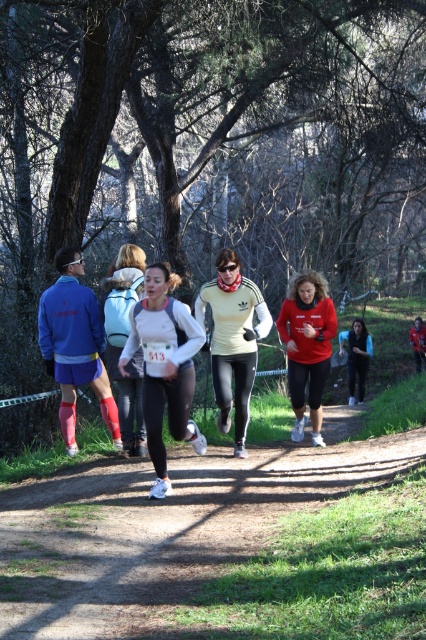
Can you confirm if matte yellow top at center is positioned below red matte running top at center?

Incorrect, matte yellow top at center is not positioned below red matte running top at center.

Which is in front, point (218, 349) or point (282, 328)?

Point (218, 349) is in front.

Locate an element on the screen. matte yellow top at center is located at coordinates (233, 340).

Looking at this image, is white jersey at center bigger than black matte leggings at center?

Yes, white jersey at center is bigger than black matte leggings at center.

Is white jersey at center to the right of black matte leggings at center from the viewer's perspective?

No, white jersey at center is not to the right of black matte leggings at center.

The image size is (426, 640). Find the location of `white jersey at center`. white jersey at center is located at coordinates (124, 340).

Between matte yellow top at center and black matte leggings at center, which one is positioned higher?

matte yellow top at center is above.

Does matte yellow top at center have a larger size compared to black matte leggings at center?

No, matte yellow top at center is not bigger than black matte leggings at center.

This screenshot has height=640, width=426. Find the location of `matte yellow top at center`. matte yellow top at center is located at coordinates (233, 340).